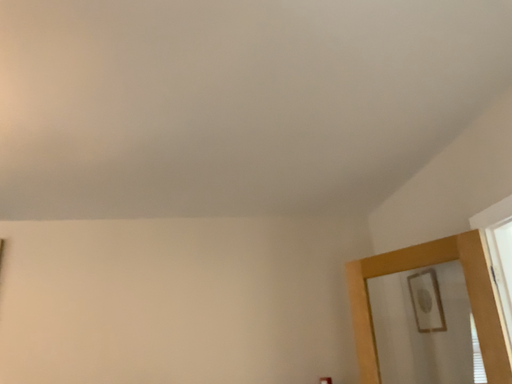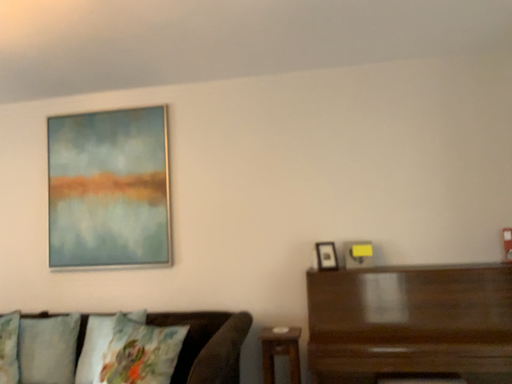
Question: How did the camera likely rotate when shooting the video?

Choices:
 (A) rotated left
 (B) rotated right

Answer: (A)